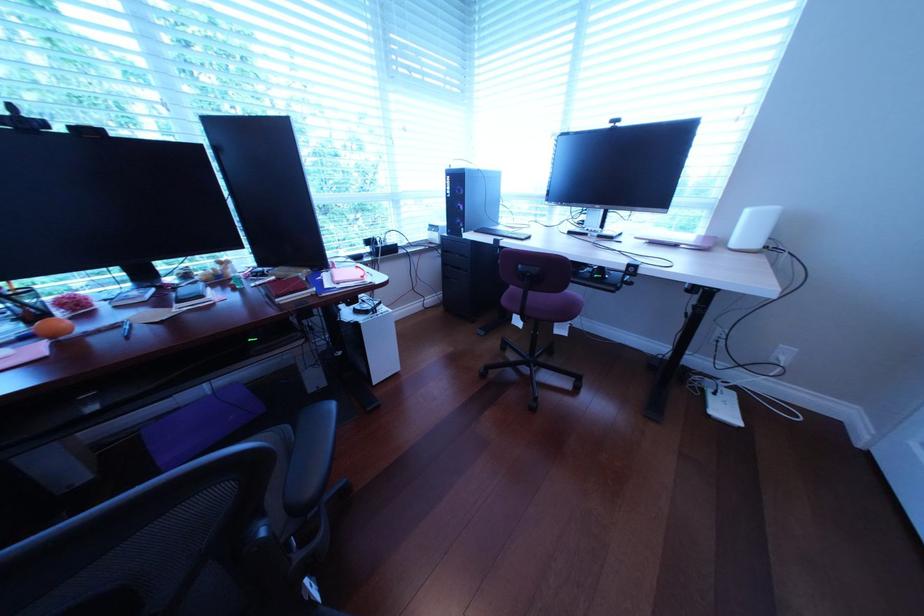
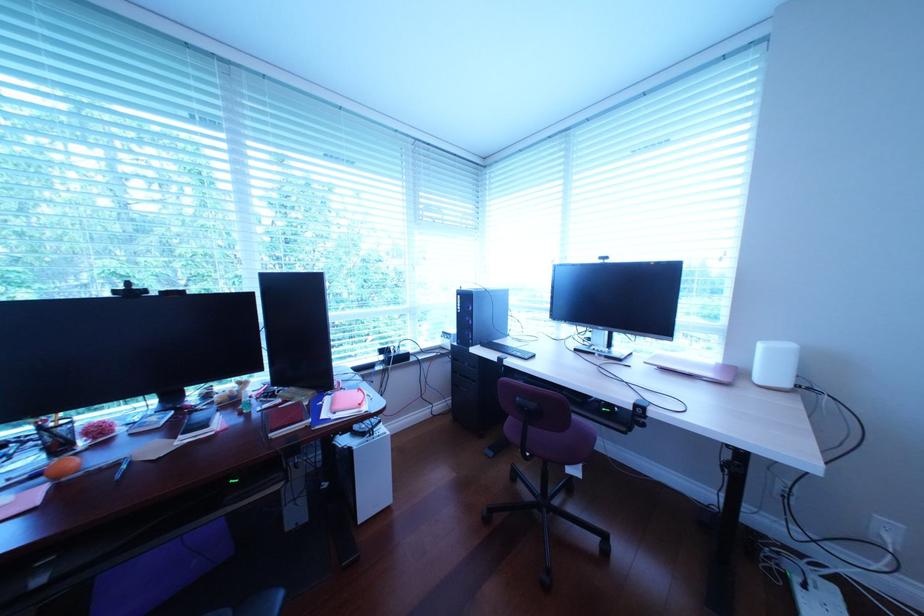
In a continuous first-person perspective shot, in which direction is the camera moving?

The cameraman moved toward right, backward.